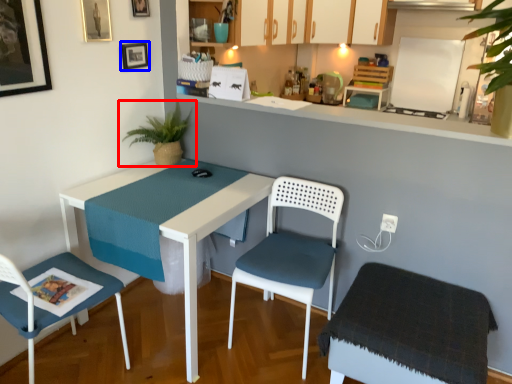
Question: Among these objects, which one is nearest to the camera, houseplant (highlighted by a red box) or picture frame (highlighted by a blue box)?

Choices:
 (A) houseplant
 (B) picture frame

Answer: (A)